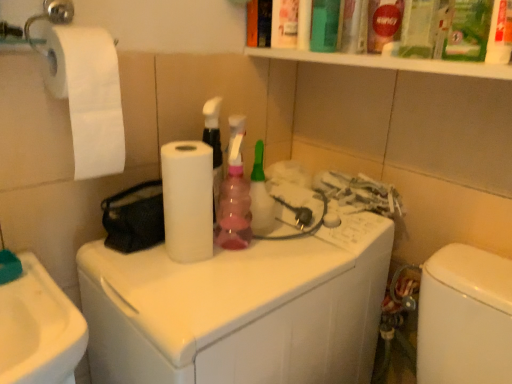
Question: Is white matte paper towel at center wider than white glossy washing machine at center?

Choices:
 (A) yes
 (B) no

Answer: (B)

Question: Are white matte paper towel at center and white glossy washing machine at center beside each other?

Choices:
 (A) yes
 (B) no

Answer: (B)

Question: From the image's perspective, does white matte paper towel at center appear lower than white glossy washing machine at center?

Choices:
 (A) no
 (B) yes

Answer: (A)

Question: Is white matte paper towel at center taller than white glossy washing machine at center?

Choices:
 (A) no
 (B) yes

Answer: (A)

Question: From a real-world perspective, is white matte paper towel at center located higher than white glossy washing machine at center?

Choices:
 (A) no
 (B) yes

Answer: (B)

Question: From a real-world perspective, relative to white glossy washing machine at center, is white matte toilet paper at left vertically above or below?

Choices:
 (A) below
 (B) above

Answer: (B)

Question: Considering the positions of white matte toilet paper at left and white glossy washing machine at center in the image, is white matte toilet paper at left wider or thinner than white glossy washing machine at center?

Choices:
 (A) wide
 (B) thin

Answer: (B)

Question: Is white matte toilet paper at left situated inside white glossy washing machine at center or outside?

Choices:
 (A) outside
 (B) inside

Answer: (A)

Question: Relative to white glossy washing machine at center, is white matte toilet paper at left in front or behind?

Choices:
 (A) behind
 (B) front

Answer: (A)

Question: Choose the correct answer: Is white matte toilet paper at left inside pink plastic spray bottle at center or outside it?

Choices:
 (A) inside
 (B) outside

Answer: (B)

Question: From the image's perspective, is white matte toilet paper at left above or below pink plastic spray bottle at center?

Choices:
 (A) below
 (B) above

Answer: (B)

Question: Is point (86, 163) positioned closer to the camera than point (244, 213)?

Choices:
 (A) farther
 (B) closer

Answer: (B)

Question: From their relative heights in the image, would you say white matte toilet paper at left is taller or shorter than pink plastic spray bottle at center?

Choices:
 (A) short
 (B) tall

Answer: (B)

Question: Would you say pink plastic spray bottle at center is to the left or to the right of white matte paper towel at center in the picture?

Choices:
 (A) right
 (B) left

Answer: (A)

Question: Is pink plastic spray bottle at center taller or shorter than white matte paper towel at center?

Choices:
 (A) short
 (B) tall

Answer: (B)